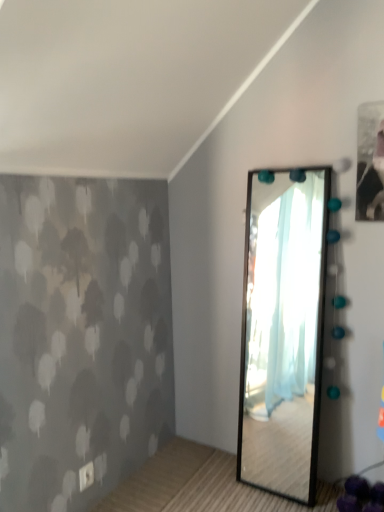
The image size is (384, 512). What do you see at coordinates (283, 332) in the screenshot?
I see `black glass mirror at center` at bounding box center [283, 332].

Identify the location of black glass mirror at center. (283, 332).

Image resolution: width=384 pixels, height=512 pixels. I want to click on black glass mirror at center, so click(283, 332).